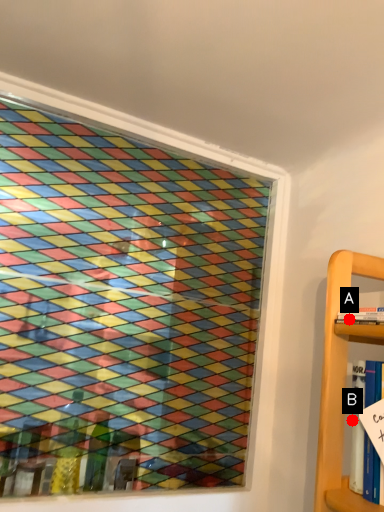
Question: Two points are circled on the image, labeled by A and B beside each circle. Which of the following is the closest to the observer?

Choices:
 (A) A is closer
 (B) B is closer

Answer: (A)